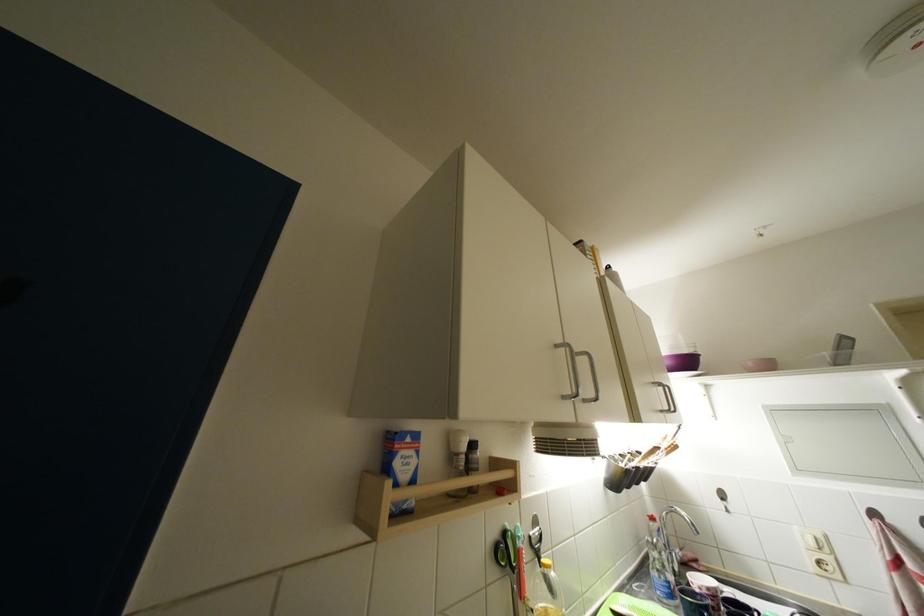
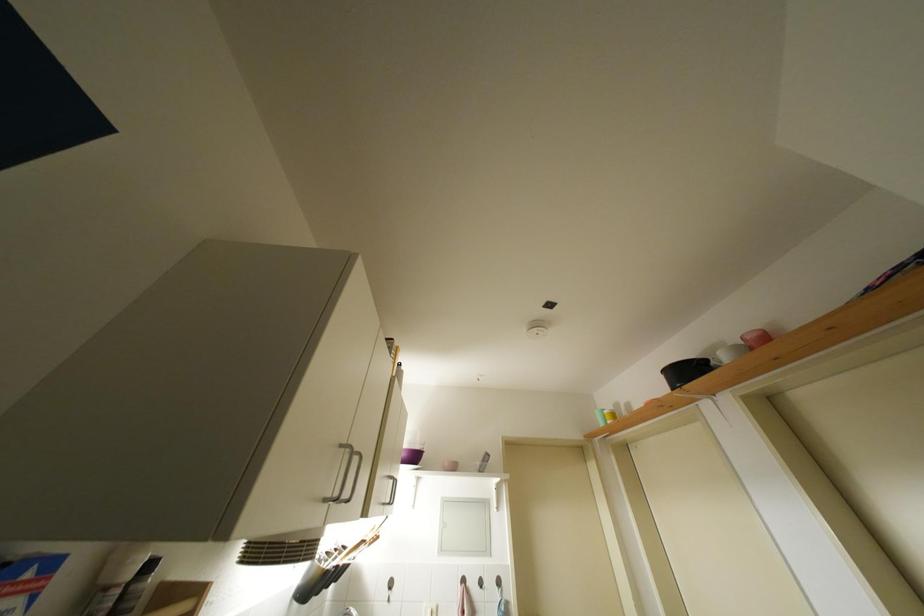
Find the pixel in the second image that matches (564,350) in the first image.

(347, 450)